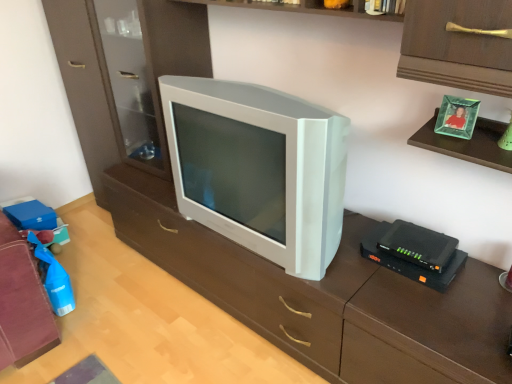
In order to click on vacant area on top of black plastic router at right (from a real-world perspective) in this screenshot , I will do `click(415, 236)`.